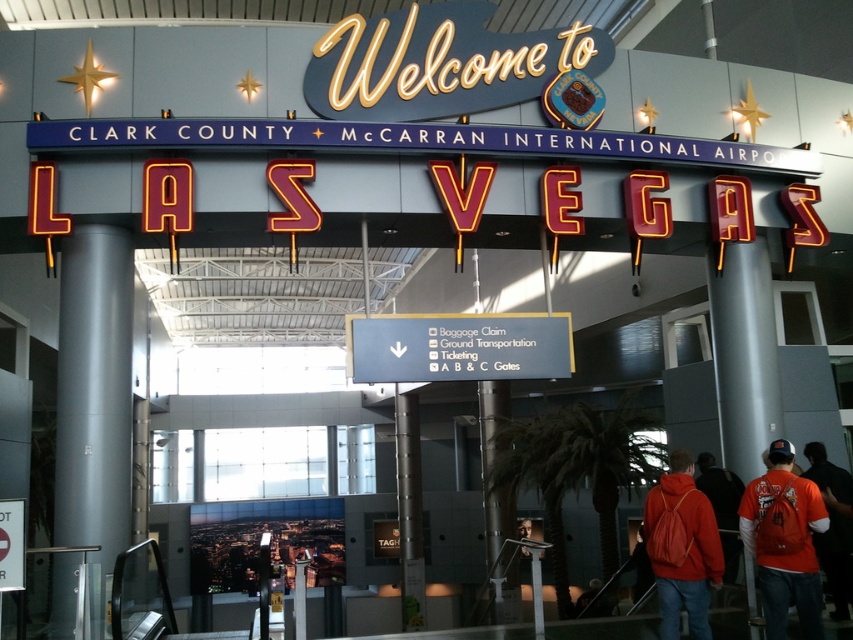
You are standing at the entrance of Clark County McCarran International Airport, looking at the iconic Welcome to Las Vegas sign. You see a point marked at coordinate [786,552]. What object is located at that point?

The point at coordinate [786,552] indicates an orange fabric backpack at lower right.